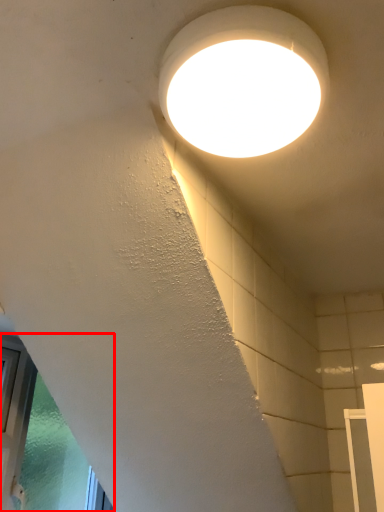
Question: From the image's perspective, what is the correct spatial positioning of window (annotated by the red box) in reference to lamp?

Choices:
 (A) below
 (B) above

Answer: (A)